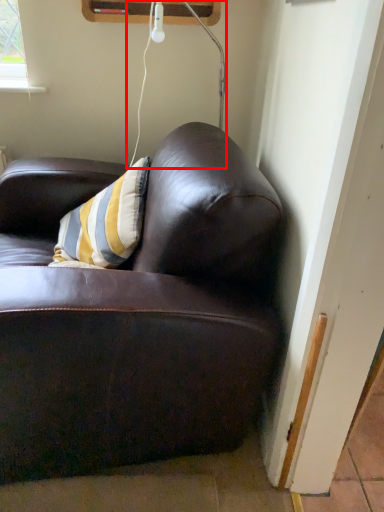
Question: From the image's perspective, what is the correct spatial positioning of lamp (annotated by the red box) in reference to studio couch?

Choices:
 (A) above
 (B) below

Answer: (A)